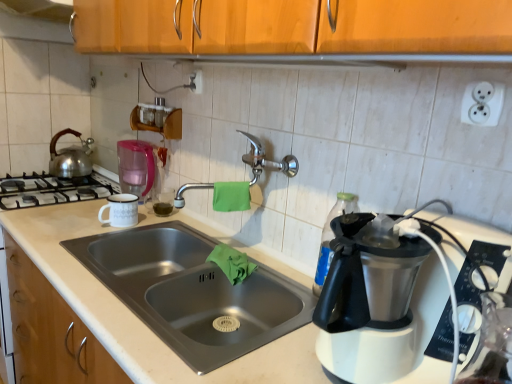
Question: Should I look upward or downward to see silver metallic kettle at left?

Choices:
 (A) up
 (B) down

Answer: (A)

Question: Is wooden cabinet at upper center further to the viewer compared to silver metallic kettle at left?

Choices:
 (A) no
 (B) yes

Answer: (A)

Question: Does wooden cabinet at upper center have a lesser height compared to silver metallic kettle at left?

Choices:
 (A) yes
 (B) no

Answer: (A)

Question: Is the surface of wooden cabinet at upper center in direct contact with silver metallic kettle at left?

Choices:
 (A) no
 (B) yes

Answer: (A)

Question: Is wooden cabinet at upper center facing away from silver metallic kettle at left?

Choices:
 (A) no
 (B) yes

Answer: (A)

Question: Does wooden cabinet at upper center appear on the left side of silver metallic kettle at left?

Choices:
 (A) no
 (B) yes

Answer: (A)

Question: From a real-world perspective, is wooden cabinet at upper center on top of silver metallic kettle at left?

Choices:
 (A) yes
 (B) no

Answer: (A)

Question: Considering the relative positions of white enamel mug at left and green cloth at sink, which ranks as the first material in bottom-to-top order, in the image provided, is white enamel mug at left to the right of green cloth at sink, which ranks as the first material in bottom-to-top order, from the viewer's perspective?

Choices:
 (A) no
 (B) yes

Answer: (A)

Question: Is the depth of white enamel mug at left less than that of green cloth at sink, which ranks as the first material in bottom-to-top order?

Choices:
 (A) no
 (B) yes

Answer: (A)

Question: Is white enamel mug at left turned away from green cloth at sink, which is the 2th material from top to bottom?

Choices:
 (A) no
 (B) yes

Answer: (A)

Question: Can you confirm if white enamel mug at left is thinner than green cloth at sink, which is the 2th material from top to bottom?

Choices:
 (A) yes
 (B) no

Answer: (B)

Question: From the image's perspective, does white enamel mug at left appear higher than green cloth at sink, which is the 2th material from top to bottom?

Choices:
 (A) no
 (B) yes

Answer: (B)

Question: From the image's perspective, would you say white enamel mug at left is shown under green cloth at sink, which is the 2th material from top to bottom?

Choices:
 (A) no
 (B) yes

Answer: (A)

Question: Is satin nickel faucet at center next to transparent plastic bottle at right and touching it?

Choices:
 (A) no
 (B) yes

Answer: (A)